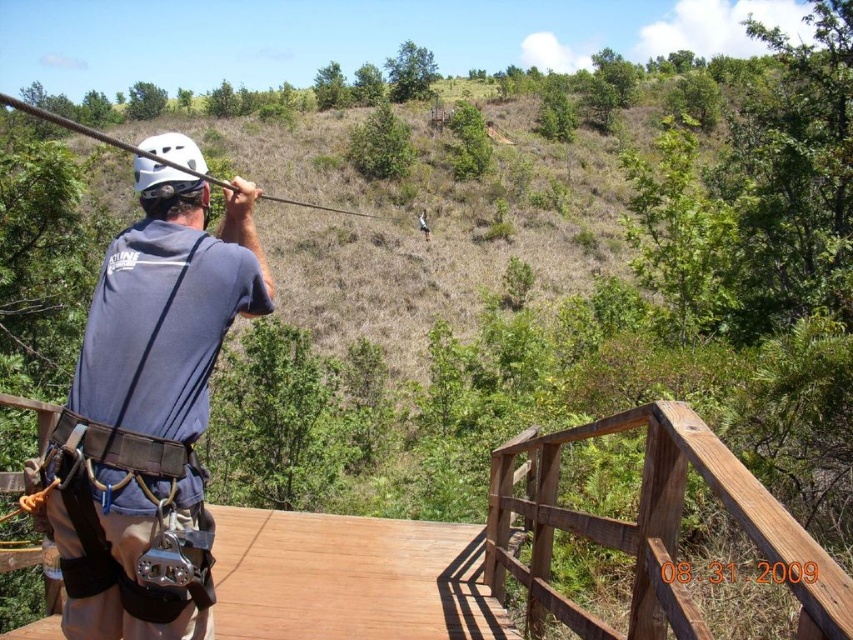
Is brown wooden bridge at center above white matte helmet at upper left?

Actually, brown wooden bridge at center is below white matte helmet at upper left.

The image size is (853, 640). What are the coordinates of `brown wooden bridge at center` in the screenshot? It's located at (653, 528).

Identify the location of brown wooden bridge at center. This screenshot has height=640, width=853. pos(653,528).

Is the position of brown wooden bridge at center less distant than that of brown wooden rail at lower right?

No, it is not.

Can you confirm if brown wooden bridge at center is positioned below brown wooden rail at lower right?

Yes, brown wooden bridge at center is below brown wooden rail at lower right.

Is point (552, 456) positioned behind point (498, 452)?

No, it is not.

I want to click on brown wooden bridge at center, so click(653, 528).

Does point (157, 172) lie in front of point (352, 211)?

Yes.

Locate an element on the screen. The height and width of the screenshot is (640, 853). white matte helmet at upper left is located at coordinates (167, 166).